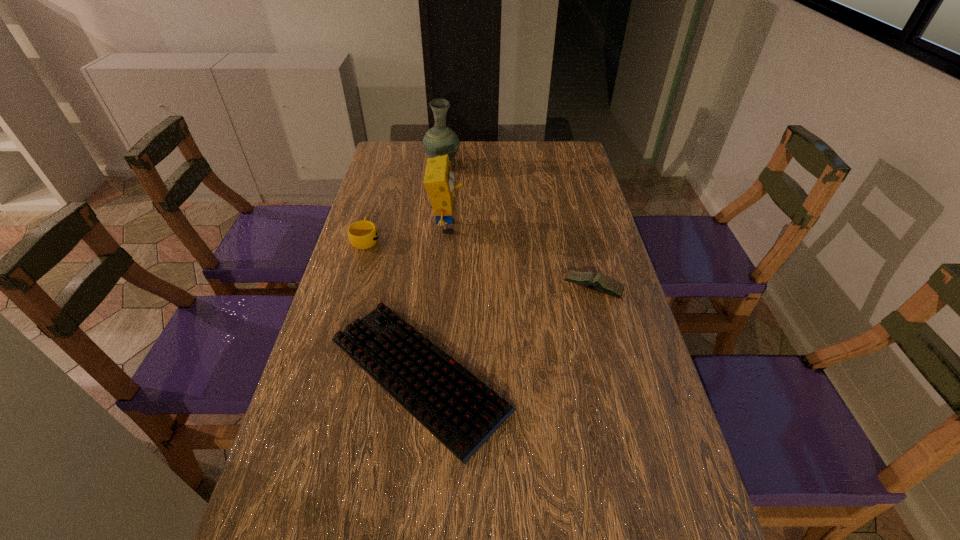
Find the location of a particular element. This screenshot has width=960, height=540. vacant space that satisfies the following two spatial constraints: 1. on the face of the fourth farthest object; 2. on the left side of the sponge is located at coordinates (443, 288).